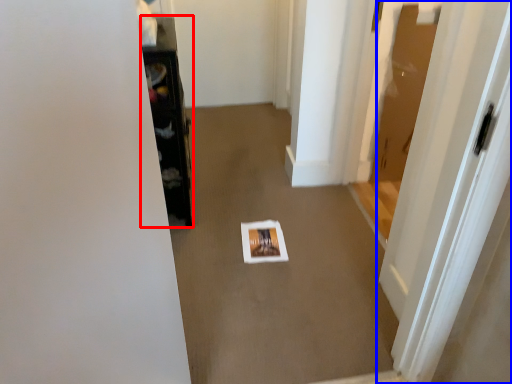
Question: Which point is further to the camera, furniture (highlighted by a red box) or door (highlighted by a blue box)?

Choices:
 (A) furniture
 (B) door

Answer: (A)